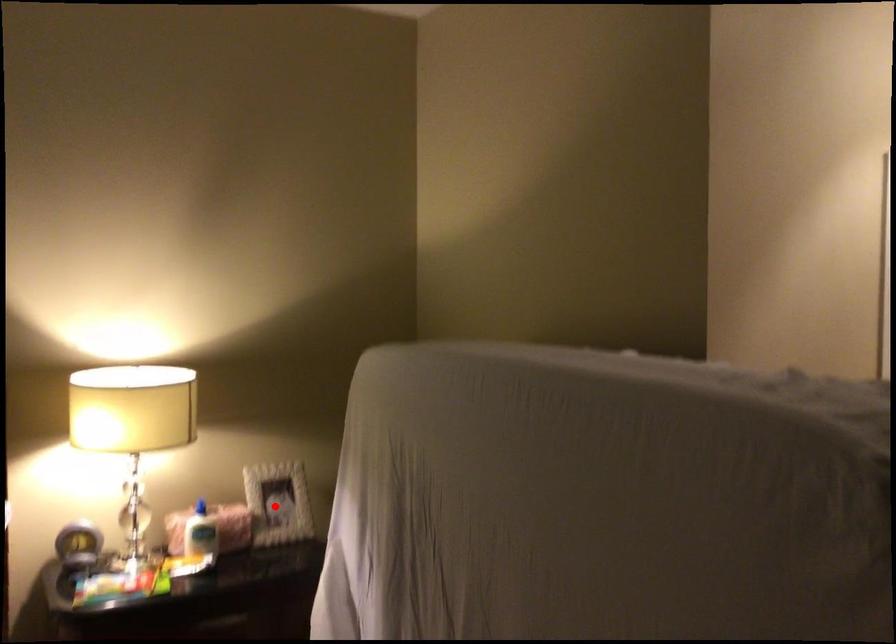
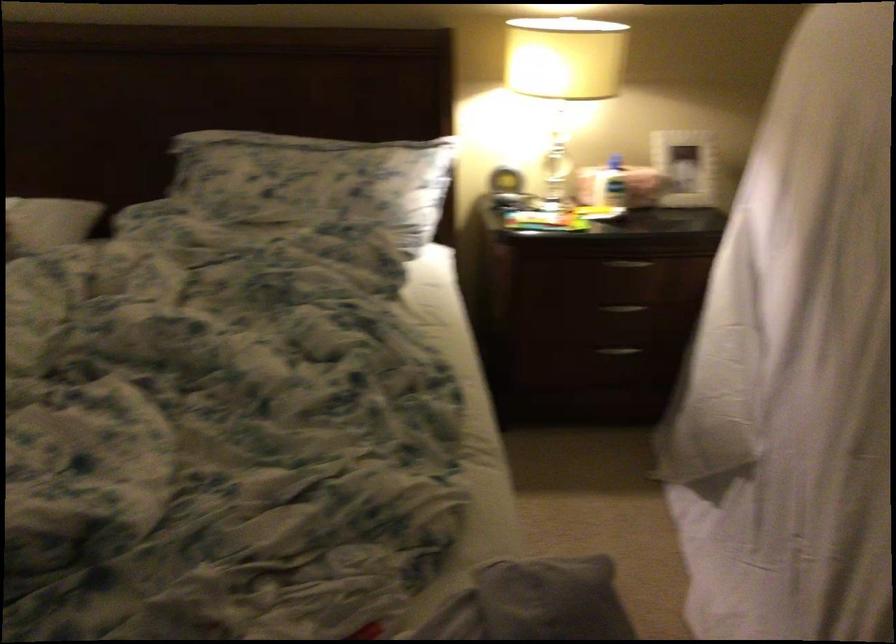
In the second image, find the point that corresponds to the highlighted location in the first image.

(684, 167)